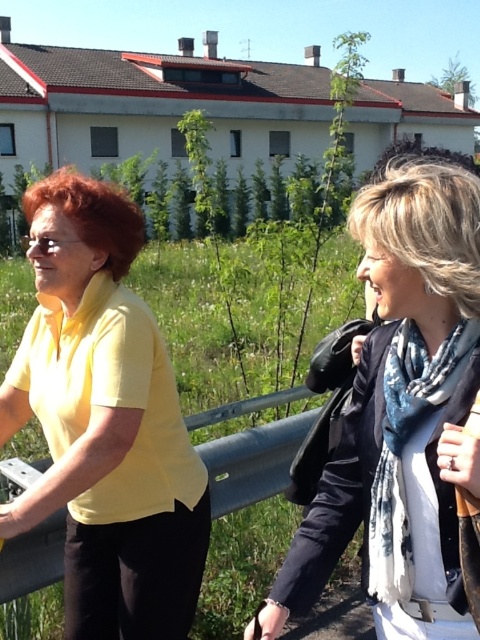
Question: Which point is farther to the camera?

Choices:
 (A) blue printed scarf at right
 (B) yellow matte shirt at left
 (C) white scarf at center

Answer: (B)

Question: Is yellow matte shirt at left below blue printed scarf at right?

Choices:
 (A) no
 (B) yes

Answer: (B)

Question: Is yellow matte shirt at left above blue printed scarf at right?

Choices:
 (A) yes
 (B) no

Answer: (B)

Question: Is yellow matte shirt at left wider than white scarf at center?

Choices:
 (A) no
 (B) yes

Answer: (B)

Question: Which object is closer to the camera taking this photo?

Choices:
 (A) blue printed scarf at right
 (B) yellow matte shirt at left
 (C) white scarf at center

Answer: (C)

Question: Considering the real-world distances, which object is closest to the white scarf at center?

Choices:
 (A) yellow matte shirt at left
 (B) blue printed scarf at right

Answer: (B)